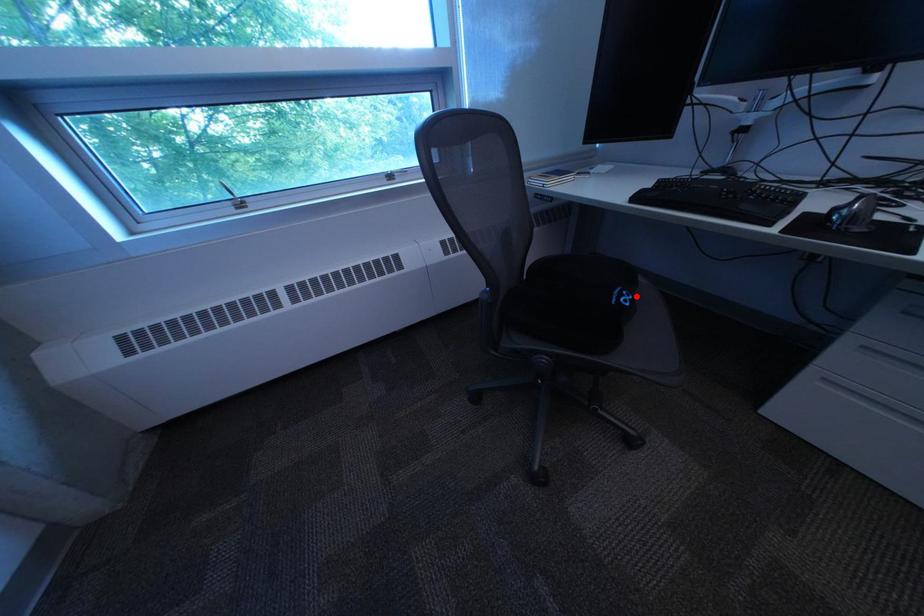
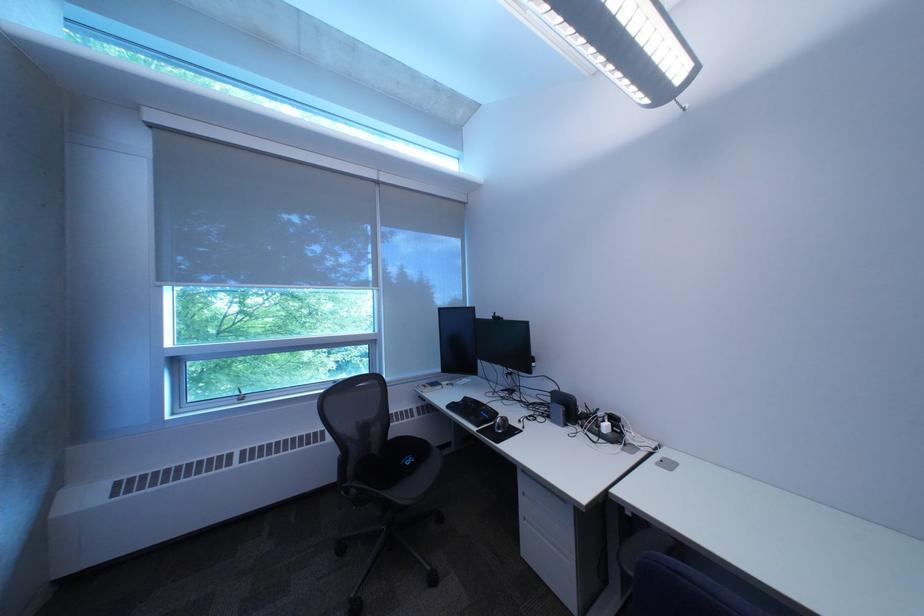
Locate, in the second image, the point that corresponds to the highlighted location in the first image.

(423, 461)